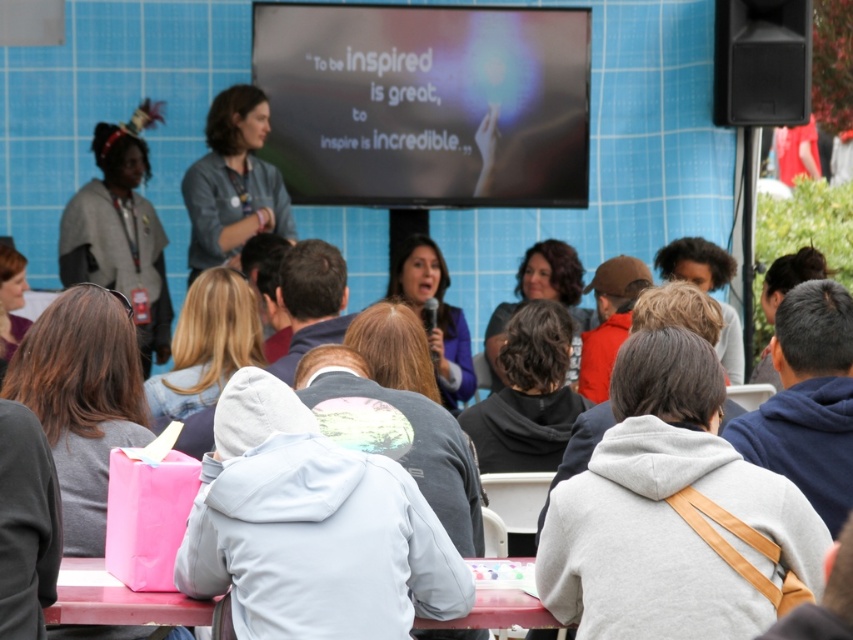
Question: Is gray hoodie at center thinner than pink plastic table at lower center?

Choices:
 (A) yes
 (B) no

Answer: (A)

Question: Does gray hoodie at center appear under pink plastic table at lower center?

Choices:
 (A) yes
 (B) no

Answer: (B)

Question: Is gray hoodie at center below pink plastic table at lower center?

Choices:
 (A) yes
 (B) no

Answer: (B)

Question: Among these objects, which one is farthest from the camera?

Choices:
 (A) gray hoodie at center
 (B) pink plastic table at lower center

Answer: (A)